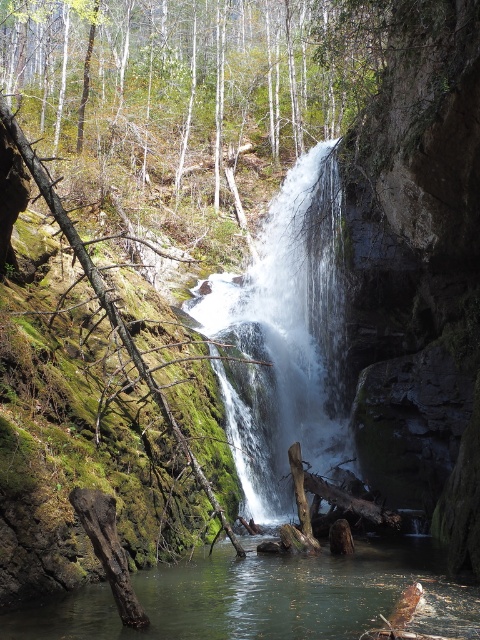
Question: Estimate the real-world distances between objects in this image. Which object is closer to the clear water at center?

Choices:
 (A) white frothy water at center
 (B) green mossy tree at center

Answer: (A)

Question: Which of the following is the farthest from the observer?

Choices:
 (A) (48, 29)
 (B) (264, 596)
 (C) (260, 321)

Answer: (A)

Question: Which object is positioned farthest from the clear water at center?

Choices:
 (A) white frothy water at center
 (B) green mossy tree at center

Answer: (B)

Question: Does green mossy tree at center appear on the right side of white frothy water at center?

Choices:
 (A) no
 (B) yes

Answer: (A)

Question: Can you confirm if white frothy water at center is positioned to the right of clear water at center?

Choices:
 (A) no
 (B) yes

Answer: (A)

Question: Is green mossy tree at center closer to camera compared to white frothy water at center?

Choices:
 (A) no
 (B) yes

Answer: (A)